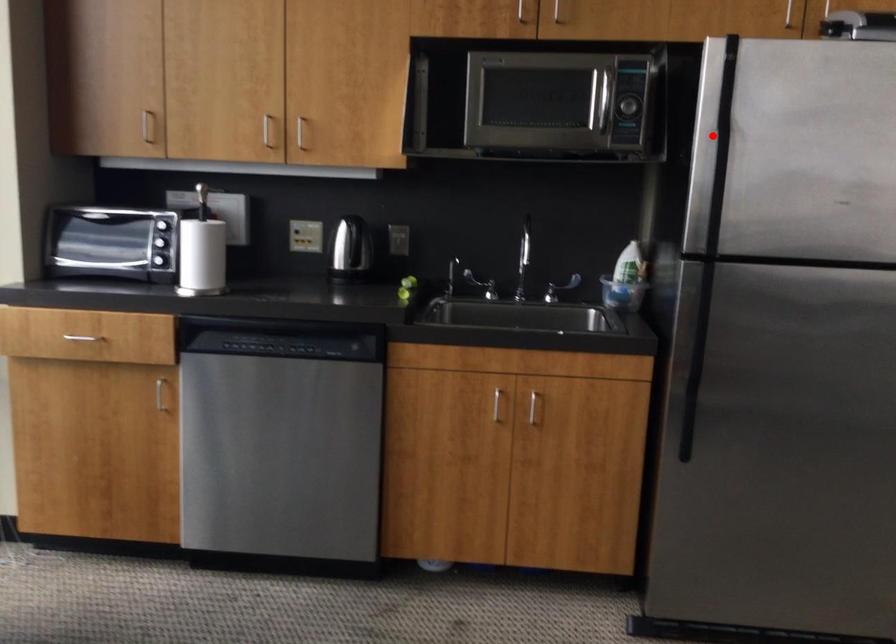
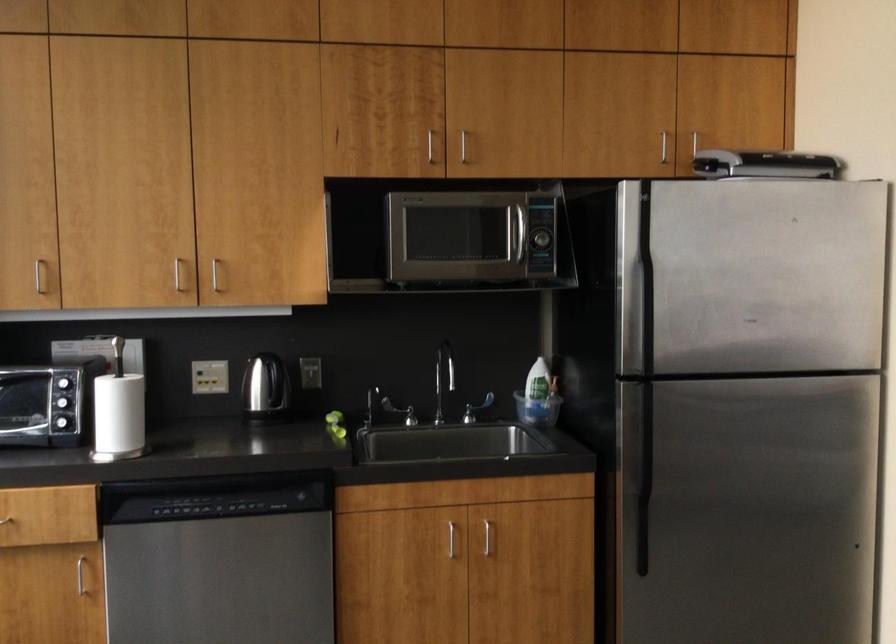
Find the pixel in the second image that matches the highlighted location in the first image.

(636, 267)